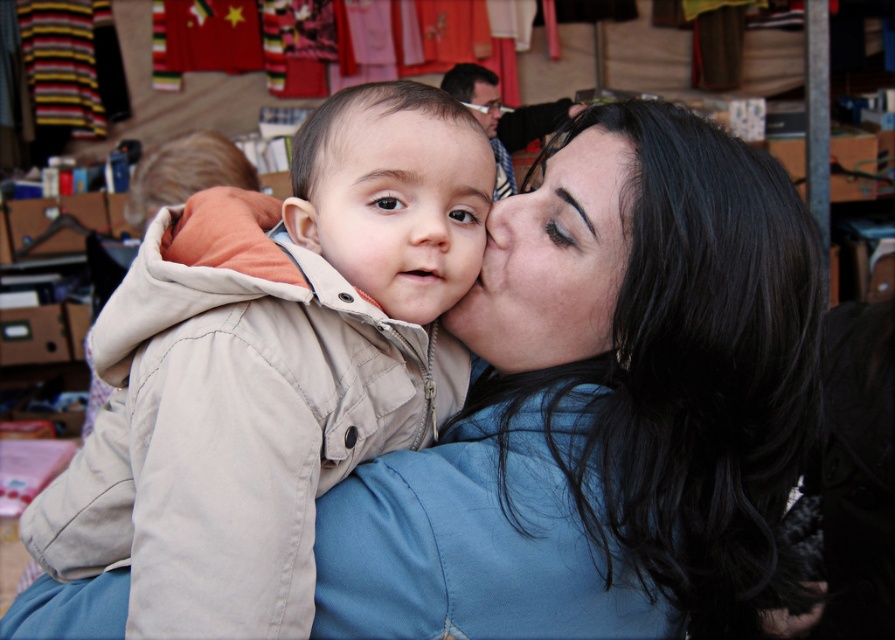
Question: Is matte beige jacket at center to the right of smooth skin face at center from the viewer's perspective?

Choices:
 (A) no
 (B) yes

Answer: (A)

Question: Does matte beige jacket at center appear over matte black face at center?

Choices:
 (A) no
 (B) yes

Answer: (A)

Question: Can you confirm if smooth skin face at center is thinner than matte black face at center?

Choices:
 (A) no
 (B) yes

Answer: (A)

Question: Which point is closer to the camera taking this photo?

Choices:
 (A) (557, 278)
 (B) (103, 369)
 (C) (422, 202)

Answer: (C)

Question: Which is farther from the beige cotton jacket at center?

Choices:
 (A) matte black face at center
 (B) smooth skin face at center
 (C) matte beige jacket at center

Answer: (A)

Question: Which point is farther from the camera taking this photo?

Choices:
 (A) (484, 131)
 (B) (570, 336)
 (C) (462, 128)

Answer: (A)